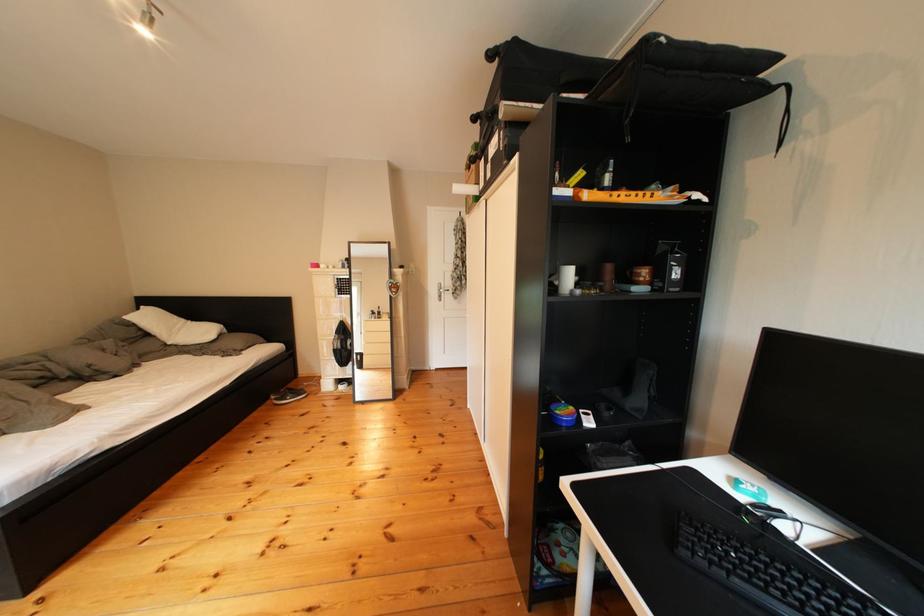
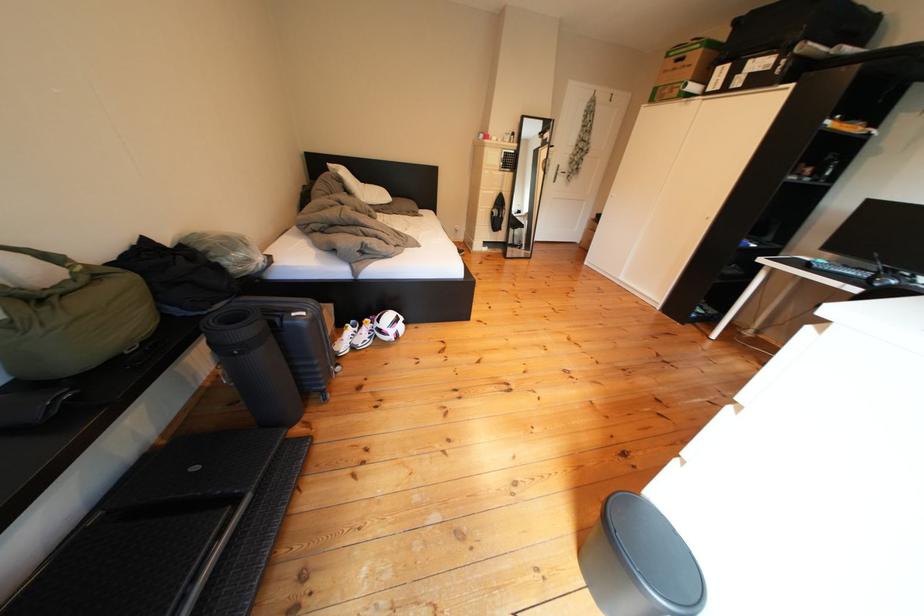
The images are taken continuously from a first-person perspective. In which direction are you moving?

The movement direction of the cameraman is left, backward.